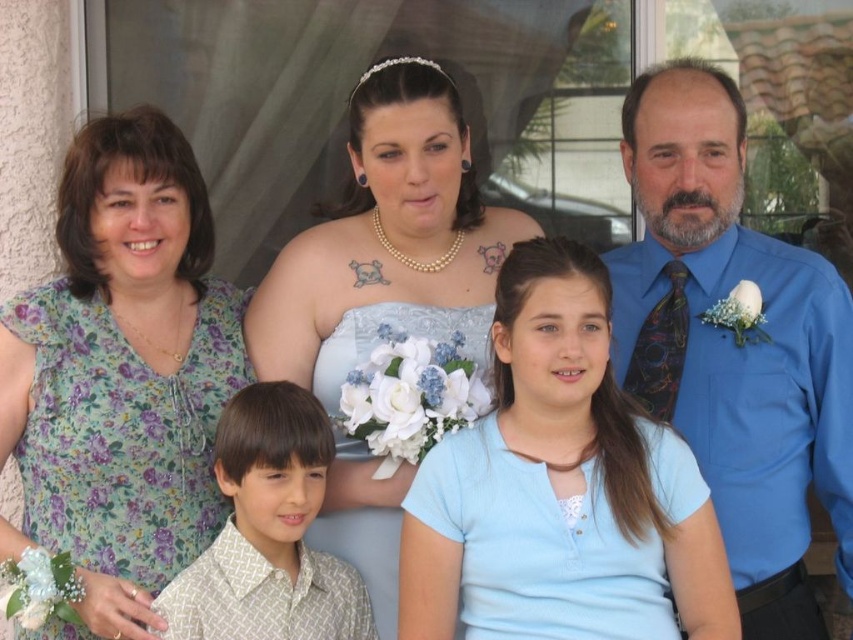
Which is behind, point (158, 387) or point (374, 141)?

Positioned behind is point (158, 387).

Does point (196, 168) lie behind point (387, 620)?

Yes, it is behind point (387, 620).

The image size is (853, 640). In order to click on green floral dress at left in this screenshot , I will do `click(120, 374)`.

Is pearl necklace at upper center smaller than white textured shirt at center?

No, pearl necklace at upper center is not smaller than white textured shirt at center.

Between pearl necklace at upper center and white textured shirt at center, which one is positioned lower?

white textured shirt at center is lower down.

Image resolution: width=853 pixels, height=640 pixels. Describe the element at coordinates (387, 241) in the screenshot. I see `pearl necklace at upper center` at that location.

This screenshot has width=853, height=640. Find the location of `pearl necklace at upper center`. pearl necklace at upper center is located at coordinates (387, 241).

Between blue silk shirt at right and pearl necklace at upper center, which one is positioned higher?

pearl necklace at upper center is higher up.

Is blue silk shirt at right thinner than pearl necklace at upper center?

Correct, blue silk shirt at right's width is less than pearl necklace at upper center's.

Between point (784, 476) and point (276, 333), which one is positioned behind?

Point (276, 333)

The image size is (853, 640). In order to click on blue silk shirt at right in this screenshot , I will do `click(733, 344)`.